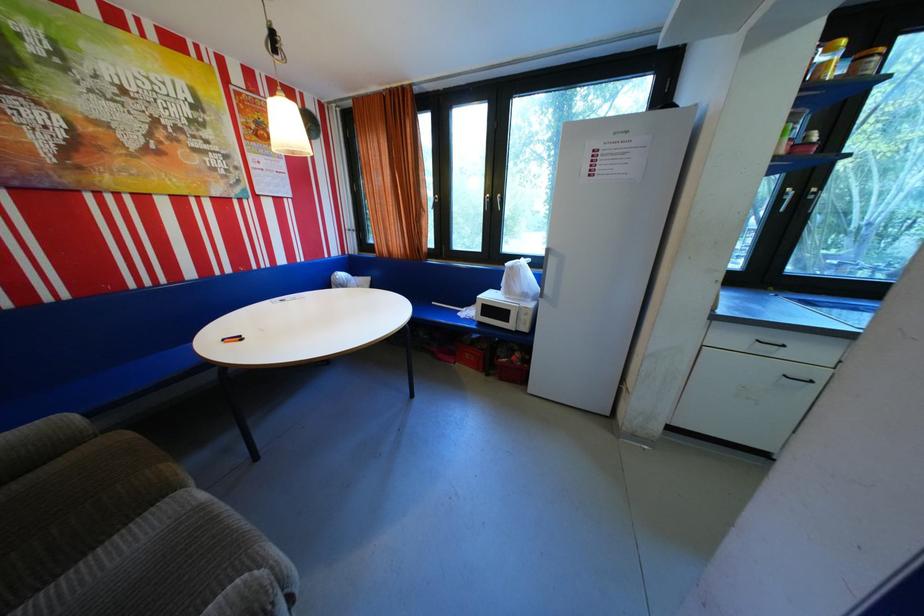
You are a GUI agent. You are given a task and a screenshot of the screen. Output one action in this format:
    pyautogui.click(x=<x>, y=<y>)
    Task: Click on the brown sofa armrest
    This screenshot has width=924, height=616.
    Given the screenshot: What is the action you would take?
    pyautogui.click(x=41, y=442)